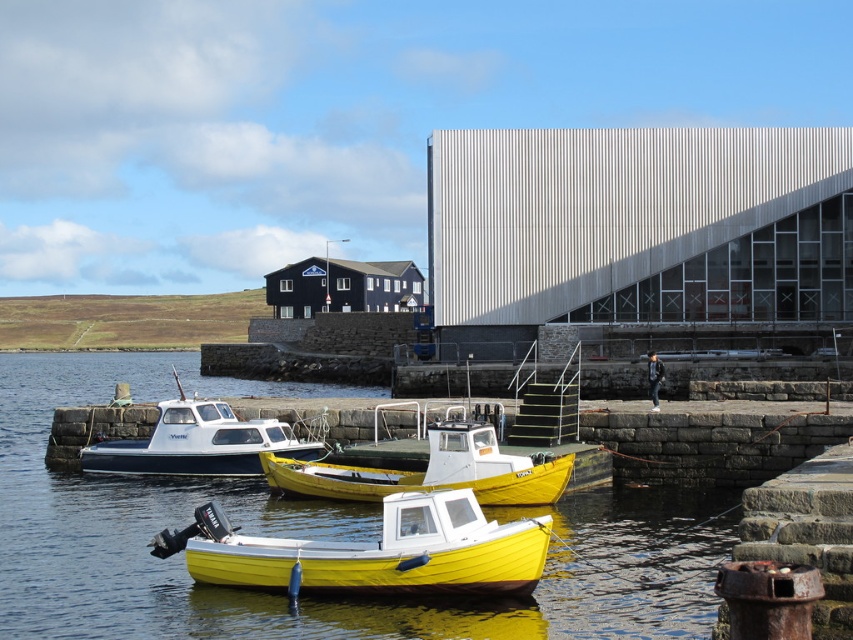
You are standing on the pier and see the yellow matte water at center and the yellow matte boat at center. Which one is closer to you?

The yellow matte water at center is closer to you because it is in front of the yellow matte boat at center.